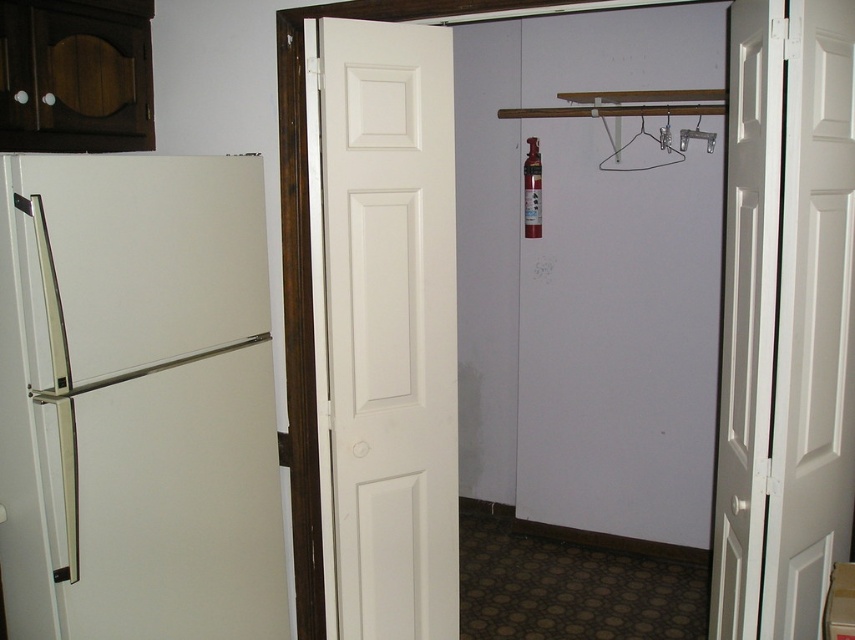
You are trying to decide which door to use to enter the hallway. The white matte door at center and the white wooden door at center are both in front of you. Which door is taller?

The white matte door at center is taller than the white wooden door at center.

You are trying to hang a coat on the metallic silver hanger at upper center but need to pass through the white wooden door at center first. Can you walk through the door without touching the hanger?

The white wooden door at center is positioned on the left side of the metallic silver hanger at upper center, so the door is to the left of the hanger. Since the door is on the left, you can walk through the door without touching the hanger as they are positioned side by side horizontally.

You are trying to decide whether to hang a new coat rack that is 1.2 meters tall on the wall. The coat rack is taller than the metallic silver hanger at upper center. Can the coat rack fit vertically next to the white wooden door at center without exceeding its height?

The white wooden door at center is taller than the metallic silver hanger at upper center. Since the coat rack is taller than the hanger, but the door is taller than the hanger, it is possible that the coat rack can fit next to the door. However, without knowing the exact height of the door, we cannot confirm for certain. But since the door is taller than the hanger, and the coat rack is only taller than the hanger, it might fit.